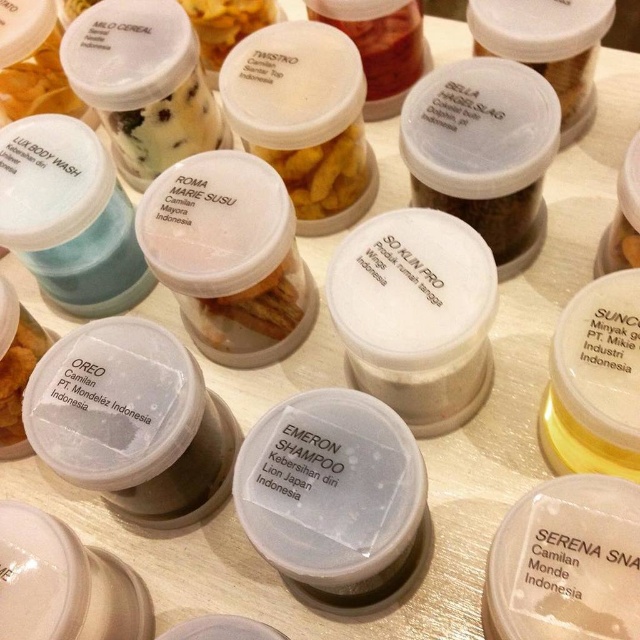
Question: From the image, what is the correct spatial relationship of translucent plastic snack at center top in relation to white matte jar at upper center?

Choices:
 (A) left
 (B) right

Answer: (A)

Question: Which point is farther from the camera taking this photo?

Choices:
 (A) (189, 1)
 (B) (12, 88)
 (C) (280, 316)
 (D) (557, 83)

Answer: (B)

Question: From the image, what is the correct spatial relationship of translucent plastic snack at center in relation to white matte jar at upper center?

Choices:
 (A) right
 (B) left

Answer: (B)

Question: Does transparent plastic shampoo at center appear under yellow matte snack at center?

Choices:
 (A) yes
 (B) no

Answer: (A)

Question: Which object appears farthest from the camera in this image?

Choices:
 (A) yellow matte snack at center
 (B) white plastic oreo at center
 (C) white plastic container at upper left
 (D) white matte jar at upper center

Answer: (A)

Question: Considering the real-world distances, which object is farthest from the translucent plastic snack at center?

Choices:
 (A) white plastic oreo at center
 (B) brown matte snack at center top
 (C) yellow matte snack at center

Answer: (C)